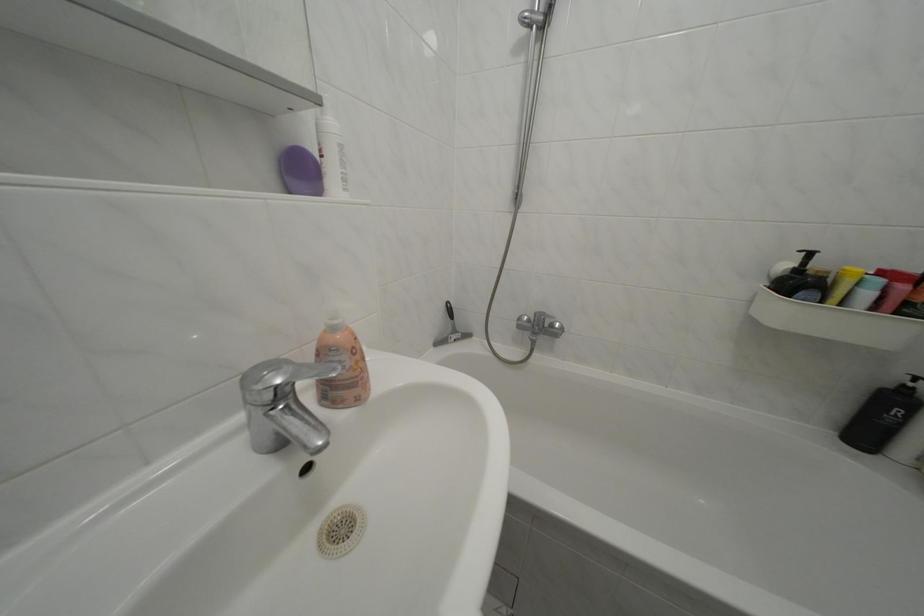
At what (x,y) coordinates should I click in order to perform the action: click on white bottle pump. Please return your answer as a coordinate pair (x, y). Looking at the image, I should click on (341, 365).